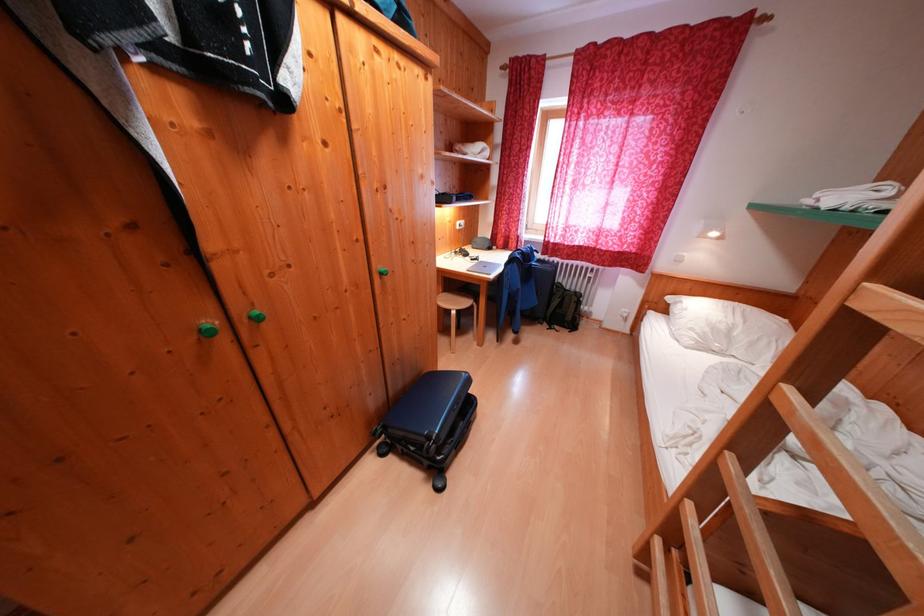
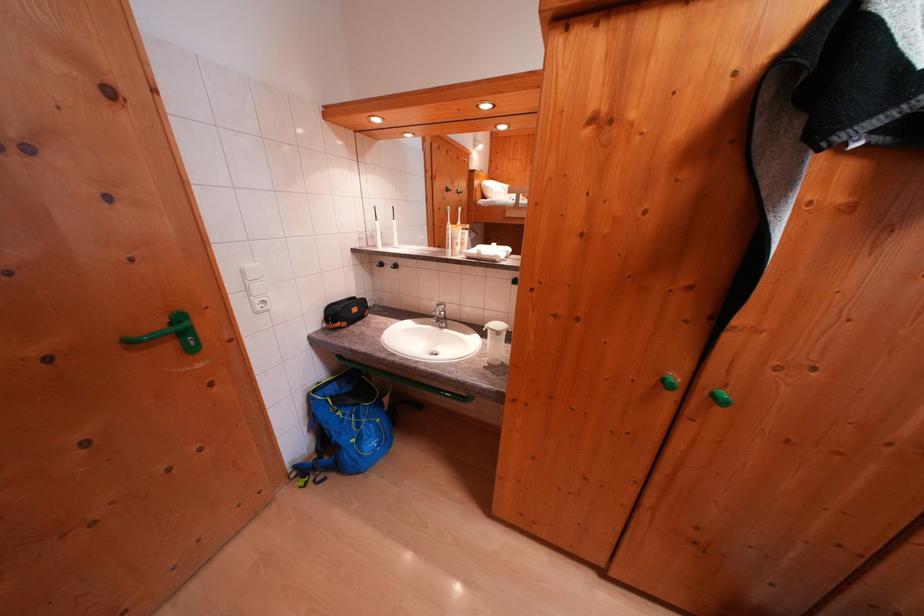
Question: The camera is either moving clockwise (left) or counter-clockwise (right) around the object. The first image is from the beginning of the video and the second image is from the end. Is the camera moving left or right when shooting the video?

Choices:
 (A) Left
 (B) Right

Answer: (B)